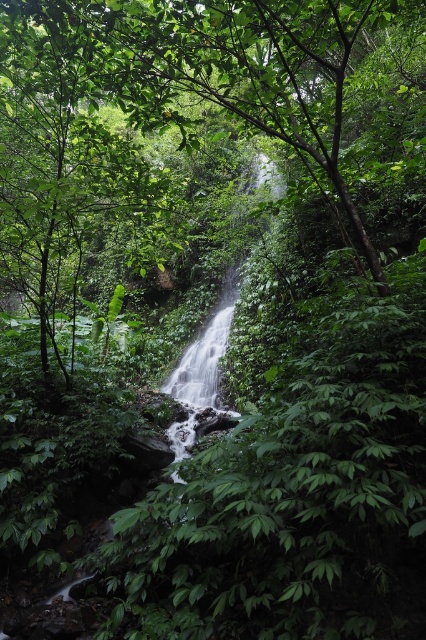
You are a hiker standing in the forest and want to take a photo of both the green leafy tree at center and the green leafy waterfall at center. Which object should you focus on first if you want to capture both in the same frame without moving your camera?

You should focus on the green leafy tree at center first because its width is larger than the green leafy waterfall at center, so it will occupy more space in the frame and ensure both are captured without needing to adjust the camera position.

You are standing in the forest looking at the waterfall. There are two points in the scene, point (227, 90) and point (209, 348). Which point is nearer to you?

Point (227, 90) is closer to the viewer than point (209, 348).

You are a hiker standing at the edge of the forest and see the green leafy tree at center and the green leafy waterfall at center. Which object is located to the left of the other?

The green leafy tree at center is positioned on the left side of green leafy waterfall at center.